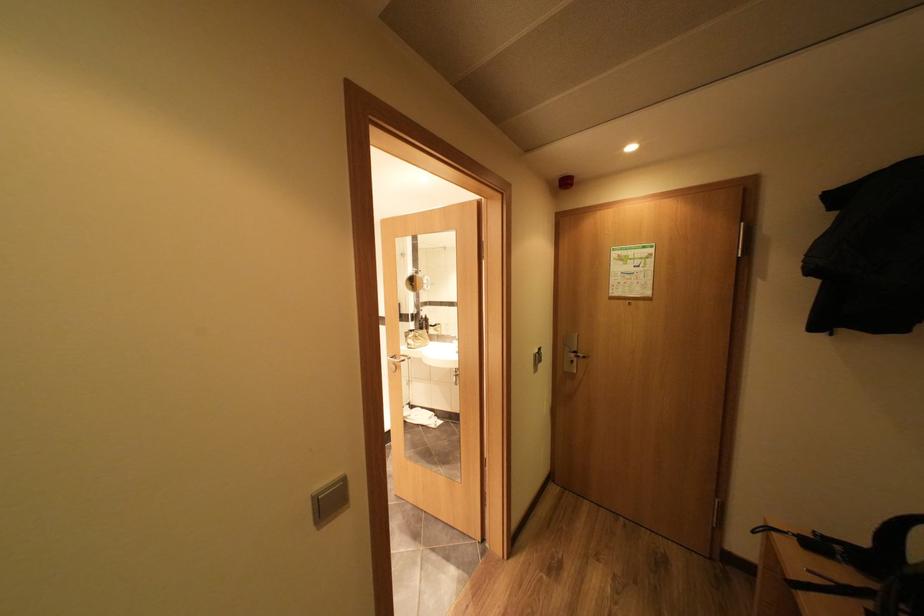
Find the location of a particular element. door key slot is located at coordinates (574, 373).